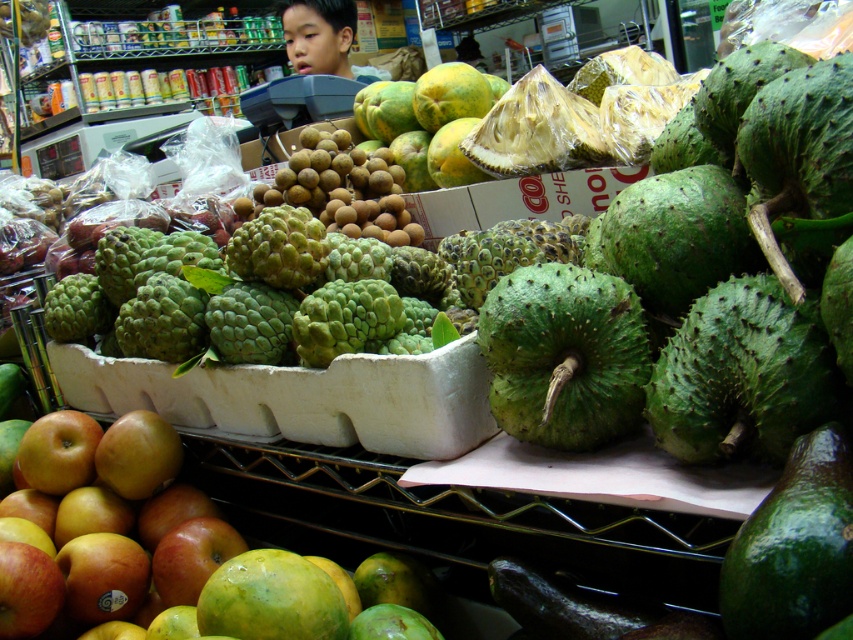
Question: Can you confirm if green spiky fruit at center is positioned to the right of green matte avocado at lower right?

Choices:
 (A) no
 (B) yes

Answer: (A)

Question: Does green spiky fruit at center appear under green matte avocado at lower right?

Choices:
 (A) yes
 (B) no

Answer: (B)

Question: Which is nearer to the smooth skin boy at upper center?

Choices:
 (A) green spiky fruit at center
 (B) green matte avocado at lower right

Answer: (A)

Question: Which is farther from the green matte avocado at lower right?

Choices:
 (A) reddish-yellow smooth apple at lower left
 (B) smooth skin boy at upper center

Answer: (B)

Question: Can you confirm if green matte avocado at lower right is positioned to the left of smooth skin boy at upper center?

Choices:
 (A) no
 (B) yes

Answer: (A)

Question: Among these points, which one is farthest from the camera?

Choices:
 (A) (328, 17)
 (B) (764, 598)
 (C) (51, 536)
 (D) (630, 301)

Answer: (A)